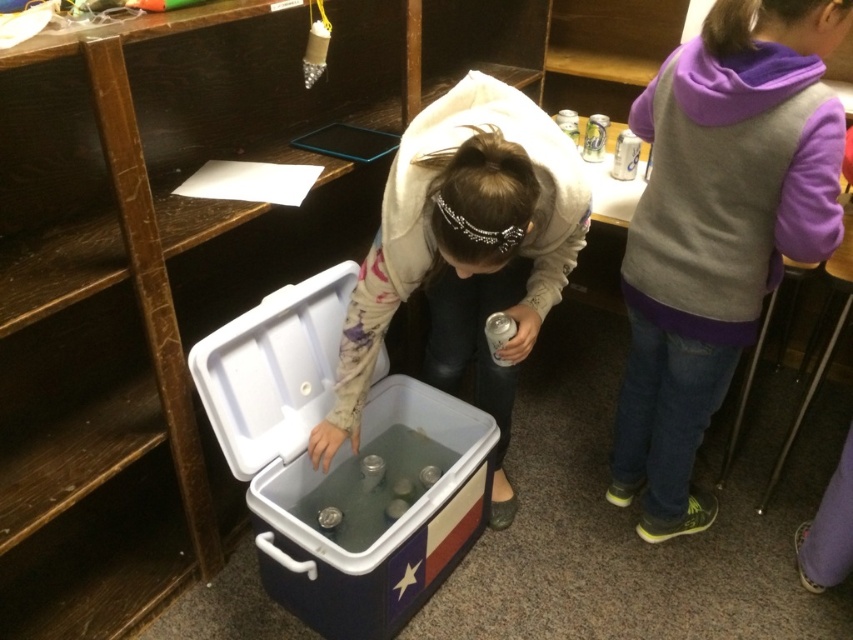
Question: Does purple fleece vest at right have a greater width compared to white plastic cooler at center?

Choices:
 (A) no
 (B) yes

Answer: (A)

Question: Does purple fleece vest at right have a larger size compared to white plastic cooler at center?

Choices:
 (A) no
 (B) yes

Answer: (A)

Question: Does blue plastic cooler at center appear on the right side of white plastic cooler at center?

Choices:
 (A) yes
 (B) no

Answer: (B)

Question: Which object appears closest to the camera in this image?

Choices:
 (A) white plastic cooler at center
 (B) blue plastic cooler at center

Answer: (A)

Question: Which point is closer to the camera taking this photo?

Choices:
 (A) (257, 310)
 (B) (508, 216)
 (C) (813, 196)

Answer: (B)

Question: Which point is farther from the camera taking this photo?

Choices:
 (A) (393, 301)
 (B) (648, 534)

Answer: (B)